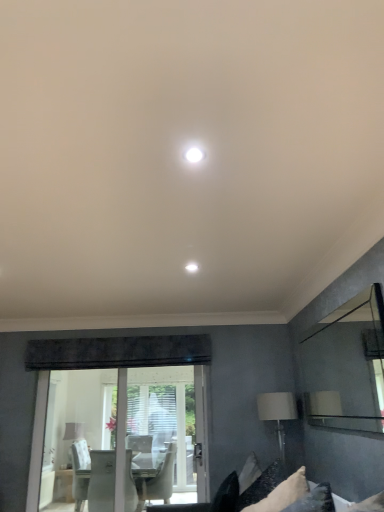
Question: Is white fabric lampshade at lower right, which appears as the first table lamp when viewed from the right, bigger or smaller than white fabric pillow at lower right?

Choices:
 (A) small
 (B) big

Answer: (B)

Question: Is point (294, 412) positioned closer to the camera than point (289, 503)?

Choices:
 (A) farther
 (B) closer

Answer: (A)

Question: Estimate the real-world distances between objects in this image. Which object is closer to the white glossy light fixture at center?

Choices:
 (A) white fabric table lamp at lower left, acting as the 2th table lamp starting from the top
 (B) clear glass mirror at right
 (C) white fabric lampshade at lower right, which is counted as the second table lamp, starting from the left
 (D) white fabric pillow at lower right

Answer: (D)

Question: Which object is positioned farthest from the white glossy light fixture at center?

Choices:
 (A) white fabric pillow at lower right
 (B) white fabric table lamp at lower left, which appears as the second table lamp when viewed from the front
 (C) clear glass mirror at right
 (D) white fabric lampshade at lower right, positioned as the second table lamp in back-to-front order

Answer: (B)